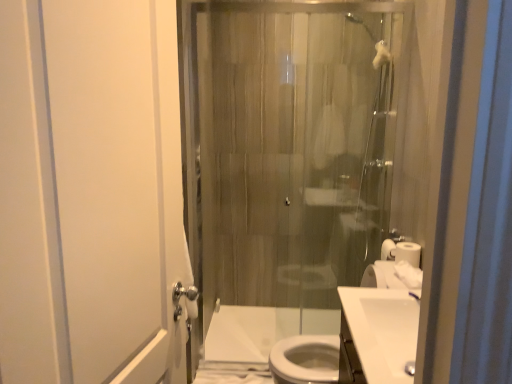
Question: In terms of height, does white glossy sink at center, which is the 2th sink from front to back, look taller or shorter compared to white glossy sink at lower right, the first sink positioned from the front?

Choices:
 (A) tall
 (B) short

Answer: (A)

Question: In the image, is white glossy sink at center, which is the 2th sink from front to back, on the left side or the right side of white glossy sink at lower right, which is the second sink from back to front?

Choices:
 (A) right
 (B) left

Answer: (B)

Question: Which object is the farthest from the white glossy sink at center, which is the 2th sink from front to back?

Choices:
 (A) white matte screen door at left
 (B) white glossy sink at lower right, the first sink positioned from the front
 (C) white matte toilet paper at right
 (D) white glossy toilet at lower center
 (E) translucent glass shower door at center

Answer: (D)

Question: Which object is positioned farthest from the white glossy toilet at lower center?

Choices:
 (A) white glossy sink at center, which appears as the 1th sink when viewed from the back
 (B) white matte toilet paper at right
 (C) white matte screen door at left
 (D) translucent glass shower door at center
 (E) white glossy sink at lower right, which is the second sink from back to front

Answer: (C)